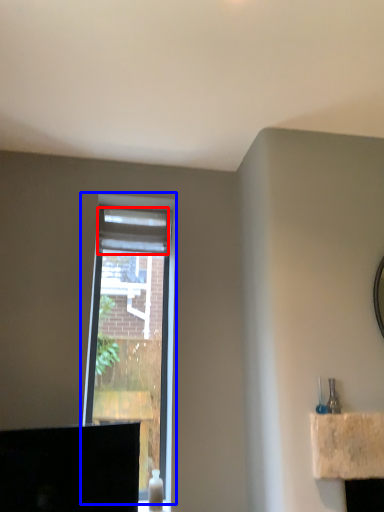
Question: Which object appears closest to the camera in this image, curtain (highlighted by a red box) or window (highlighted by a blue box)?

Choices:
 (A) curtain
 (B) window

Answer: (B)